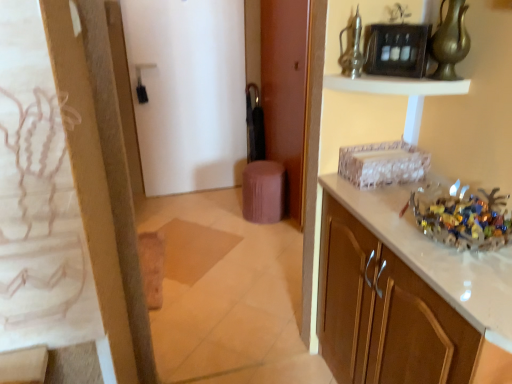
Locate an element on the screen. This screenshot has height=384, width=512. free point behind translucent glass bowl at right is located at coordinates (402, 193).